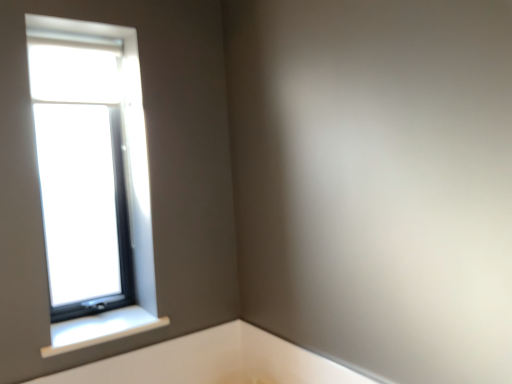
Question: Is white plastic window sill at lower left located within clear glass window at upper left?

Choices:
 (A) no
 (B) yes

Answer: (A)

Question: Is clear glass window at upper left to the right of white plastic window sill at lower left from the viewer's perspective?

Choices:
 (A) yes
 (B) no

Answer: (B)

Question: Is clear glass window at upper left next to white plastic window sill at lower left and touching it?

Choices:
 (A) no
 (B) yes

Answer: (A)

Question: Does clear glass window at upper left have a lesser height compared to white plastic window sill at lower left?

Choices:
 (A) yes
 (B) no

Answer: (B)

Question: Is clear glass window at upper left positioned behind white plastic window sill at lower left?

Choices:
 (A) yes
 (B) no

Answer: (A)

Question: Is clear glass window at upper left far away from white plastic window sill at lower left?

Choices:
 (A) yes
 (B) no

Answer: (B)

Question: Would you say clear glass window at upper left is part of white plastic window sill at lower left's contents?

Choices:
 (A) yes
 (B) no

Answer: (B)

Question: Is white plastic window sill at lower left wider than clear glass window at upper left?

Choices:
 (A) no
 (B) yes

Answer: (B)

Question: From a real-world perspective, is white plastic window sill at lower left located beneath clear glass window at upper left?

Choices:
 (A) no
 (B) yes

Answer: (B)

Question: Is white plastic window sill at lower left positioned beyond the bounds of clear glass window at upper left?

Choices:
 (A) yes
 (B) no

Answer: (A)

Question: Considering the relative sizes of white plastic window sill at lower left and clear glass window at upper left in the image provided, is white plastic window sill at lower left shorter than clear glass window at upper left?

Choices:
 (A) yes
 (B) no

Answer: (A)

Question: Are white plastic window sill at lower left and clear glass window at upper left beside each other?

Choices:
 (A) no
 (B) yes

Answer: (A)

Question: Considering their positions, is white plastic window sill at lower left located in front of or behind clear glass window at upper left?

Choices:
 (A) behind
 (B) front

Answer: (B)